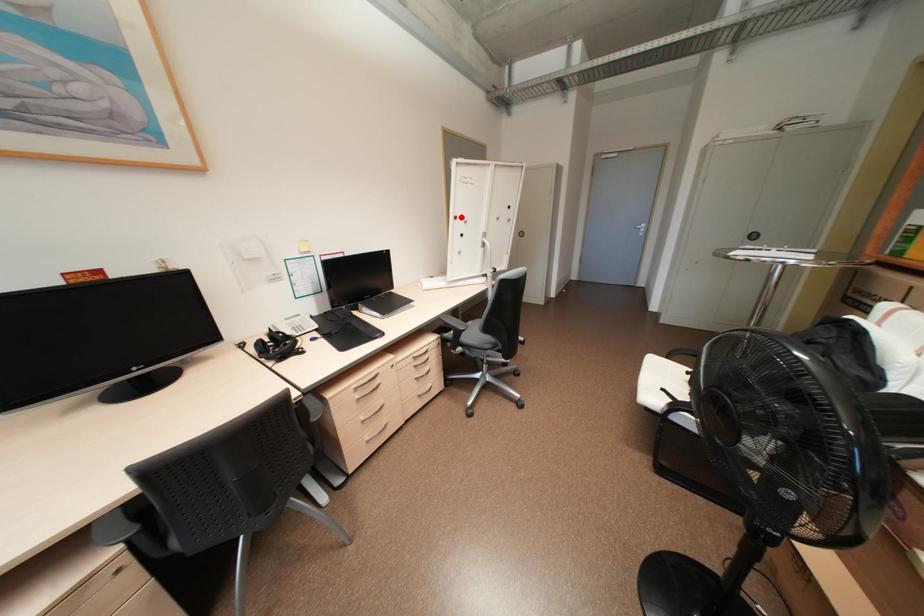
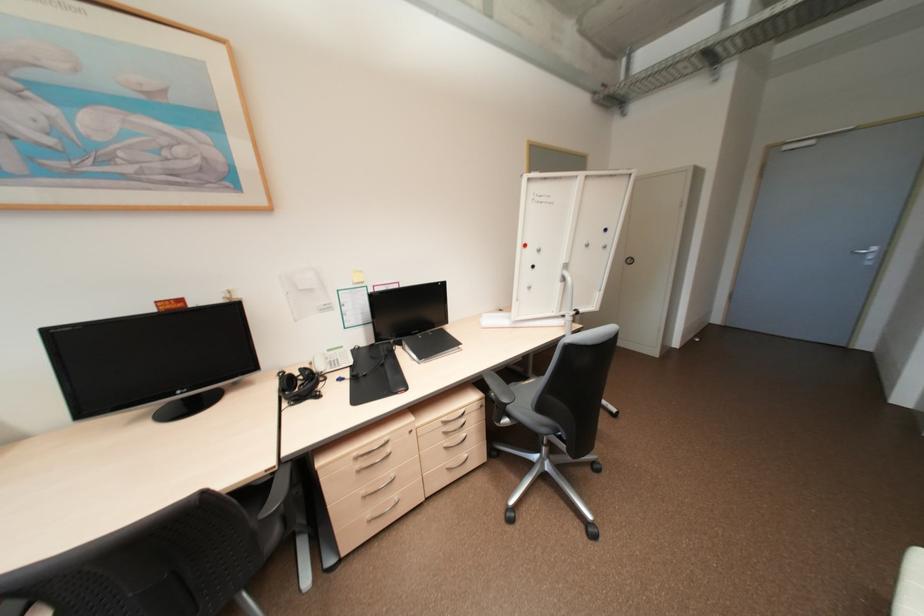
In the second image, find the point that corresponds to the highlighted location in the first image.

(530, 245)